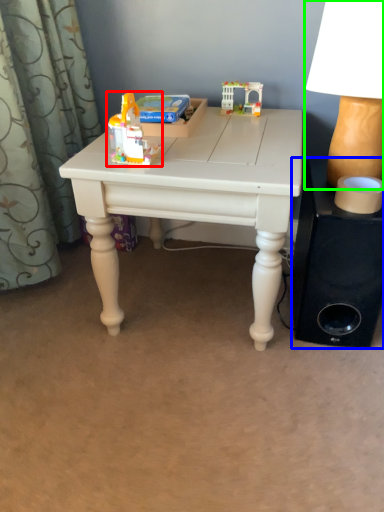
Question: Which is nearer to the toy (highlighted by a red box)? speaker (highlighted by a blue box) or table lamp (highlighted by a green box).

Choices:
 (A) speaker
 (B) table lamp

Answer: (B)